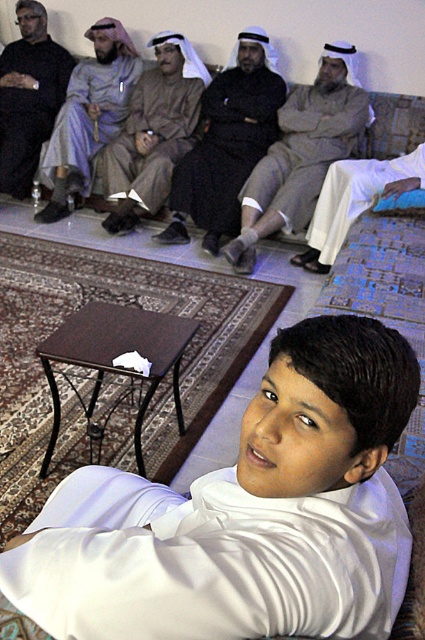
Question: Which object is closer to the camera taking this photo?

Choices:
 (A) light brown fabric robe at center
 (B) light gray fabric robe at center
 (C) white satin shirt at center

Answer: (C)

Question: Is dark matte clothing at left wider than light gray fabric robe at center?

Choices:
 (A) yes
 (B) no

Answer: (B)

Question: Which is farther from the white cotton robe at lower right?

Choices:
 (A) white satin shirt at center
 (B) light brown fabric robe at center
 (C) light gray fabric robe at center
 (D) matte brown robe at center

Answer: (A)

Question: From the image, what is the correct spatial relationship of white satin shirt at center in relation to white cotton robe at lower right?

Choices:
 (A) left
 (B) right

Answer: (A)

Question: Is white satin shirt at center thinner than dark matte clothing at left?

Choices:
 (A) no
 (B) yes

Answer: (A)

Question: Which is farther from the white satin shirt at center?

Choices:
 (A) light gray fabric robe at center
 (B) dark brown leather jacket at center

Answer: (A)